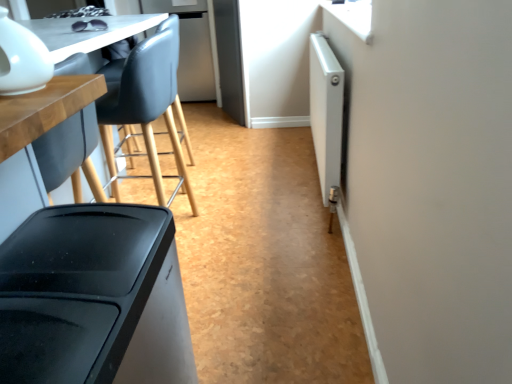
Find the location of a particular element. The image size is (512, 384). vacant space to the left of white metallic radiator at right, which is the first appliance in right-to-left order is located at coordinates (251, 178).